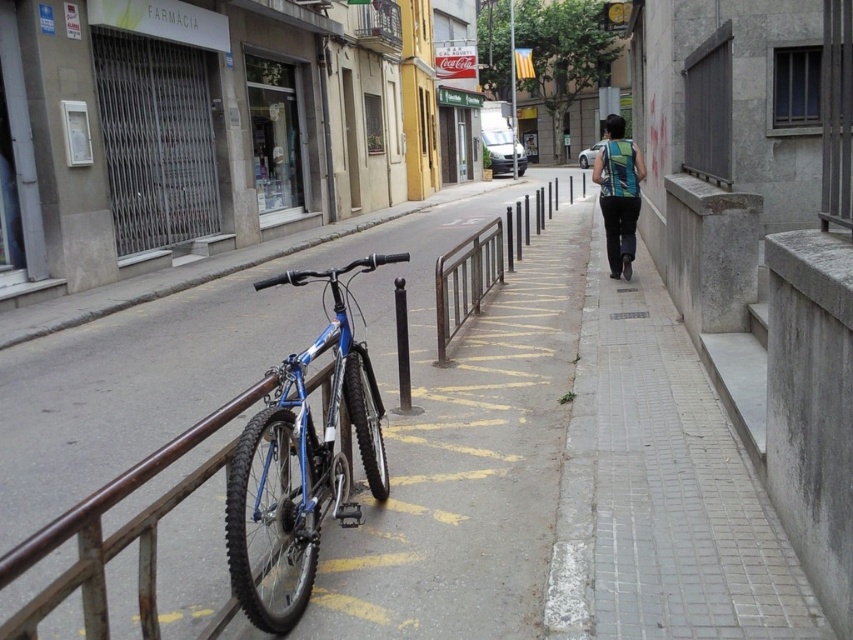
Question: Among these objects, which one is nearest to the camera?

Choices:
 (A) green striped tank top at center
 (B) brown metal rail at center

Answer: (B)

Question: Observing the image, what is the correct spatial positioning of smooth concrete pavement at center in reference to blue metallic bicycle at left?

Choices:
 (A) below
 (B) above

Answer: (B)

Question: Considering the relative positions of brown metal rail at center and green striped tank top at center in the image provided, where is brown metal rail at center located with respect to green striped tank top at center?

Choices:
 (A) above
 (B) below

Answer: (B)

Question: Which of the following is the farthest from the observer?

Choices:
 (A) (379, 454)
 (B) (498, 275)

Answer: (B)

Question: Observing the image, what is the correct spatial positioning of smooth concrete pavement at center in reference to green striped tank top at center?

Choices:
 (A) above
 (B) below

Answer: (B)

Question: Which point appears closest to the camera in this image?

Choices:
 (A) (344, 508)
 (B) (387, 316)
 (C) (467, 296)

Answer: (A)